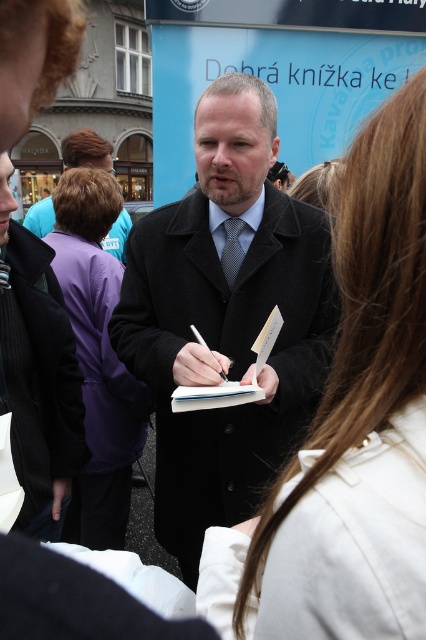
Question: Is white fabric coat at center to the right of purple fleece jacket at center from the viewer's perspective?

Choices:
 (A) yes
 (B) no

Answer: (A)

Question: Is dark gray wool coat at center positioned before purple fleece jacket at center?

Choices:
 (A) no
 (B) yes

Answer: (B)

Question: Does dark gray wool coat at center appear over purple fabric jacket at upper left?

Choices:
 (A) no
 (B) yes

Answer: (A)

Question: Estimate the real-world distances between objects in this image. Which object is farther from the dark gray wool coat at center?

Choices:
 (A) purple fabric jacket at upper left
 (B) purple fleece jacket at center
 (C) white fabric coat at center
 (D) dark blue textured tie at center

Answer: (A)

Question: Which of the following is the closest to the observer?

Choices:
 (A) (78, 244)
 (B) (249, 81)

Answer: (B)

Question: Estimate the real-world distances between objects in this image. Which object is closer to the white fabric coat at center?

Choices:
 (A) purple fabric jacket at upper left
 (B) dark gray wool coat at center
 (C) purple fleece jacket at center
 (D) dark blue textured tie at center

Answer: (B)